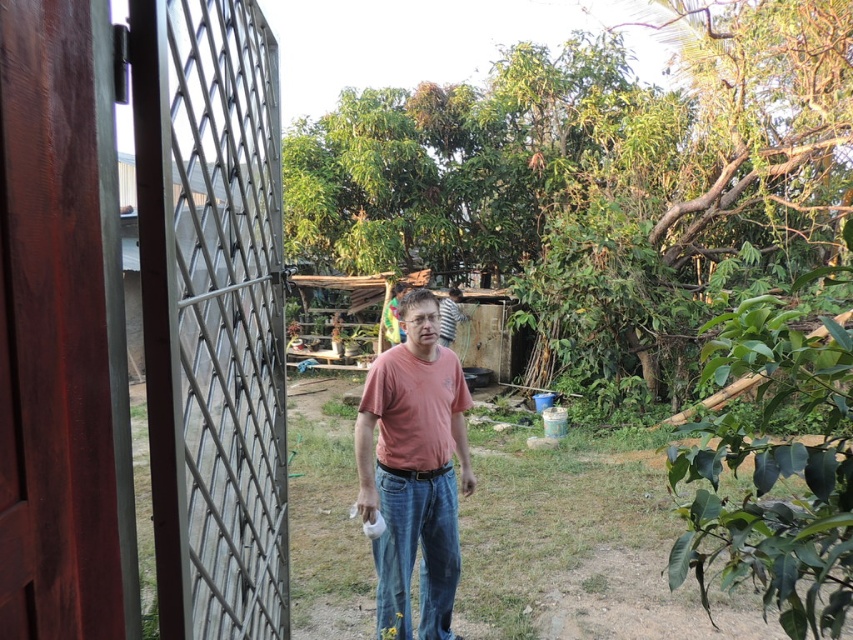
Who is positioned more to the left, brown wooden gate at left or matte pink t-shirt at center?

brown wooden gate at left

Between brown wooden gate at left and matte pink t-shirt at center, which one appears on the right side from the viewer's perspective?

matte pink t-shirt at center is more to the right.

Between point (22, 96) and point (372, 380), which one is positioned behind?

The point (372, 380) is more distant.

I want to click on brown wooden gate at left, so click(142, 321).